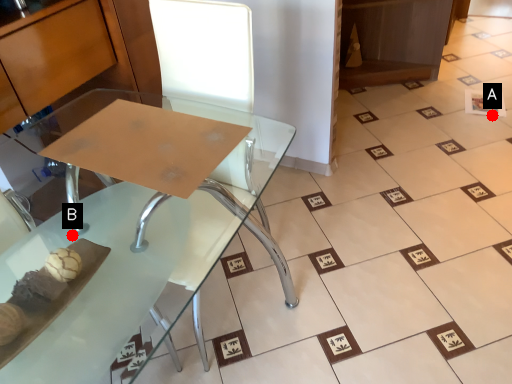
Question: Two points are circled on the image, labeled by A and B beside each circle. Which of the following is the farthest from the observer?

Choices:
 (A) A is further
 (B) B is further

Answer: (A)